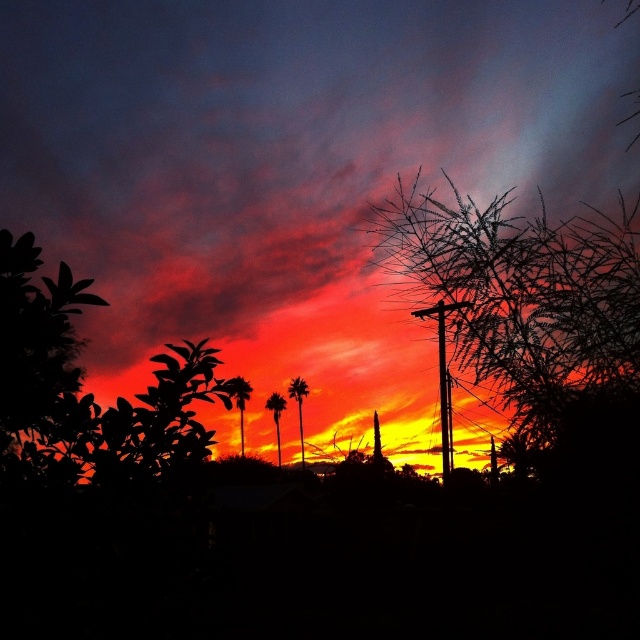
You are a photographer trying to capture the sunset. You want to place your camera so that the orange matte cloud at upper center is exactly at the center of your viewfinder. What coordinates should you aim for?

The orange matte cloud at upper center is positioned at coordinates point (291, 173), so you should aim your camera at those coordinates to center it in the viewfinder.

You are an artist trying to draw the sunset scene. You want to ensure the bare branches at upper right and the silhouette palm tree at center are placed correctly. Which object should be drawn higher on the canvas?

The bare branches at upper right should be drawn higher on the canvas because they are positioned over the silhouette palm tree at center, indicating they are above it in the scene.